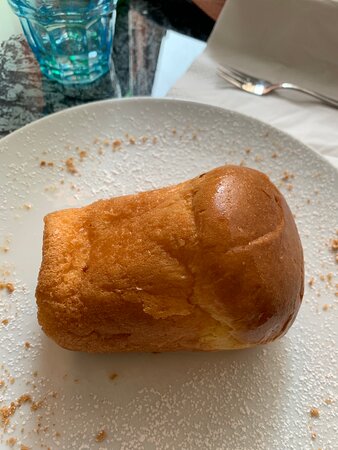
This screenshot has width=338, height=450. Identify the location of glass. (83, 33).